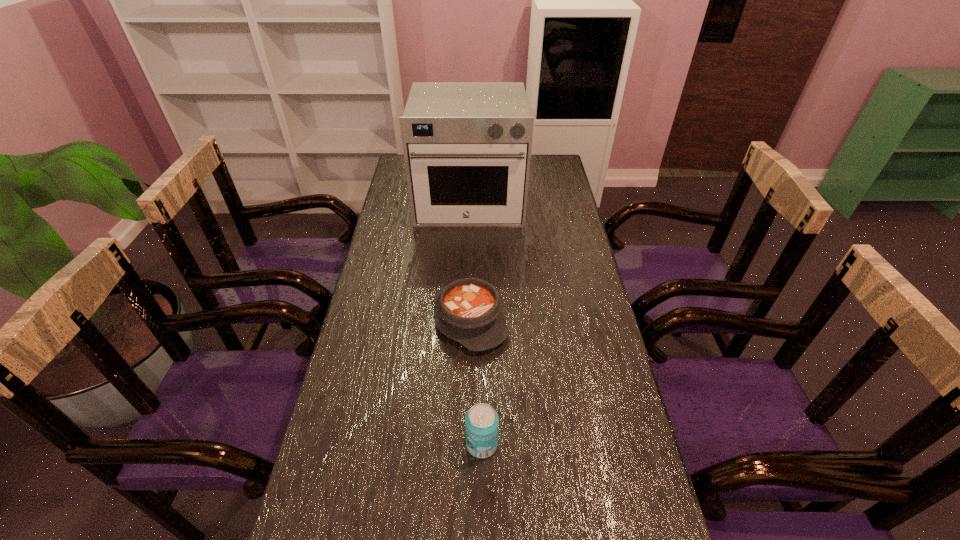
Where is `object at the left edge`? The width and height of the screenshot is (960, 540). object at the left edge is located at coordinates (467, 146).

The image size is (960, 540). Find the location of `object at the far left corner`. object at the far left corner is located at coordinates (467, 146).

Where is `vacant space at the left edge`? Image resolution: width=960 pixels, height=540 pixels. vacant space at the left edge is located at coordinates (419, 233).

Find the location of a particular element. free spot at the right edge of the desktop is located at coordinates (540, 221).

I want to click on free space between the second farthest object and the tallest object, so click(x=469, y=261).

Locate which object is the second closest to the casserole. Please provide its 2D coordinates. Your answer should be formatted as a tuple, i.e. [(x, y)], where the tuple contains the x and y coordinates of a point satisfying the conditions above.

[(467, 146)]

The height and width of the screenshot is (540, 960). Find the location of `object that is the closest one to the casserole`. object that is the closest one to the casserole is located at coordinates pyautogui.click(x=481, y=421).

Locate an element on the screen. The height and width of the screenshot is (540, 960). free spot that satisfies the following two spatial constraints: 1. on the front panel of the toaster oven; 2. on the left side of the beer can is located at coordinates (462, 444).